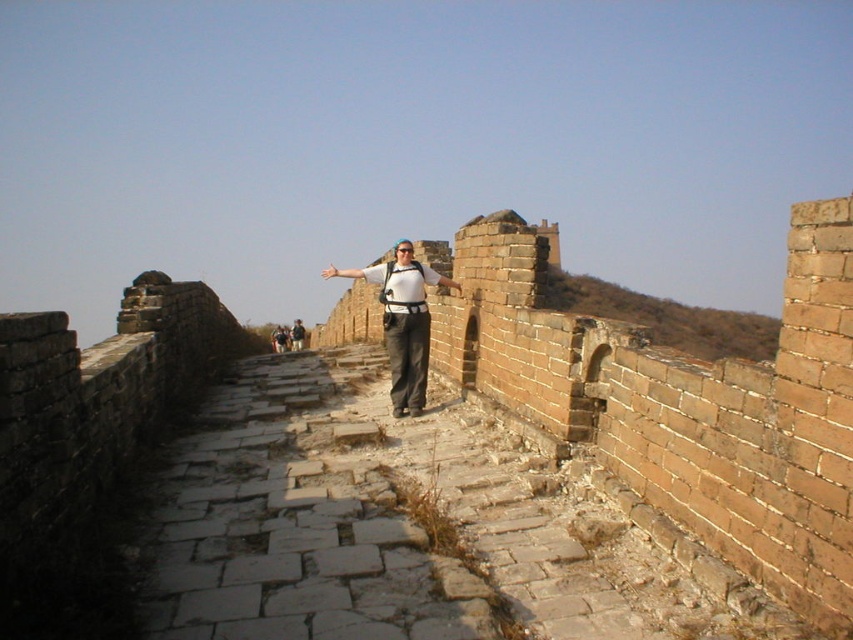
The image size is (853, 640). In order to click on matte white shirt at center in this screenshot , I will do `click(402, 321)`.

Between point (387, 333) and point (294, 326), which one is positioned behind?

The point (294, 326) is more distant.

Between point (399, 417) and point (299, 346), which one is positioned in front?

Point (399, 417) is in front.

Locate an element on the screen. The image size is (853, 640). matte white shirt at center is located at coordinates (402, 321).